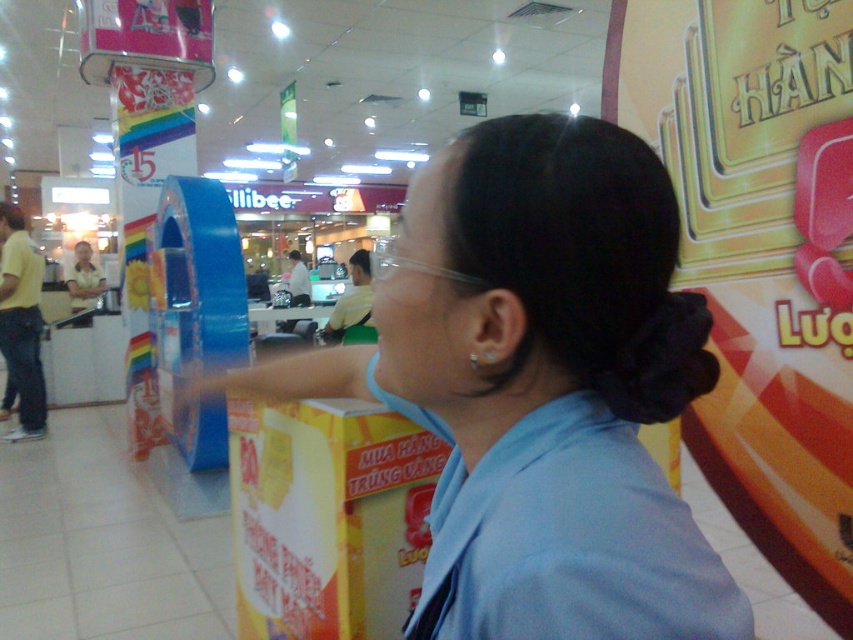
You are at the mall and see the blue fabric shirt at center. Where exactly is it located in the image?

The blue fabric shirt at center is located at point 0.608 on the x axis and 0.633 on the y axis.

You are a photographer taking a picture of the blue fabric shirt at center and the transparent plastic glasses at center. To ensure both are in focus, you need to know their vertical positions. Which one is positioned lower in the image?

The blue fabric shirt at center is located below transparent plastic glasses at center, so it is positioned lower in the image.

You are a photographer trying to capture a clear shot of the blue fabric shirt at center and transparent plastic glasses at center. Since you can only focus on one object at a time, which object should you focus on first to ensure the other is still in the frame?

The blue fabric shirt at center is positioned on the right side of transparent plastic glasses at center. To ensure both are in the frame, focus on the transparent plastic glasses at center first, as it is on the left, allowing the blue fabric shirt at center to remain in the frame when adjusting the shot.